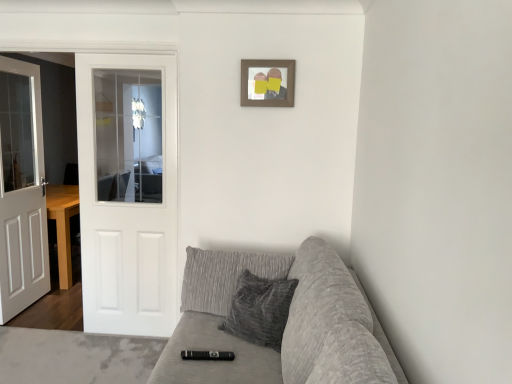
Question: Is wooden picture frame at upper center not within white wooden door at left, marked as the 2th door in a right-to-left arrangement?

Choices:
 (A) no
 (B) yes

Answer: (B)

Question: Considering the relative sizes of wooden picture frame at upper center and white wooden door at left, marked as the 2th door in a right-to-left arrangement, in the image provided, is wooden picture frame at upper center wider than white wooden door at left, marked as the 2th door in a right-to-left arrangement,?

Choices:
 (A) yes
 (B) no

Answer: (B)

Question: Can you confirm if wooden picture frame at upper center is positioned to the left of white wooden door at left, which is counted as the first door, starting from the left?

Choices:
 (A) no
 (B) yes

Answer: (A)

Question: Is the position of wooden picture frame at upper center less distant than that of white wooden door at left, which is counted as the first door, starting from the left?

Choices:
 (A) no
 (B) yes

Answer: (B)

Question: Is wooden picture frame at upper center positioned with its back to white wooden door at left, marked as the 2th door in a right-to-left arrangement?

Choices:
 (A) no
 (B) yes

Answer: (A)

Question: Can you confirm if wooden picture frame at upper center is shorter than white wooden door at left, marked as the 2th door in a right-to-left arrangement?

Choices:
 (A) no
 (B) yes

Answer: (B)

Question: Is wooden picture frame at upper center placed right next to white glossy door at left, positioned as the 1th door in right-to-left order?

Choices:
 (A) no
 (B) yes

Answer: (A)

Question: Can we say wooden picture frame at upper center lies outside white glossy door at left, positioned as the 1th door in right-to-left order?

Choices:
 (A) no
 (B) yes

Answer: (B)

Question: Considering the relative sizes of wooden picture frame at upper center and white glossy door at left, positioned as the 1th door in right-to-left order, in the image provided, is wooden picture frame at upper center wider than white glossy door at left, positioned as the 1th door in right-to-left order,?

Choices:
 (A) no
 (B) yes

Answer: (A)

Question: From the image's perspective, is wooden picture frame at upper center above white glossy door at left, the 2th door positioned from the left?

Choices:
 (A) yes
 (B) no

Answer: (A)

Question: From a real-world perspective, is wooden picture frame at upper center on top of white glossy door at left, positioned as the 1th door in right-to-left order?

Choices:
 (A) no
 (B) yes

Answer: (B)

Question: Can you confirm if wooden picture frame at upper center is bigger than white glossy door at left, positioned as the 1th door in right-to-left order?

Choices:
 (A) yes
 (B) no

Answer: (B)

Question: Is wooden picture frame at upper center smaller than textured gray couch at lower right?

Choices:
 (A) yes
 (B) no

Answer: (A)